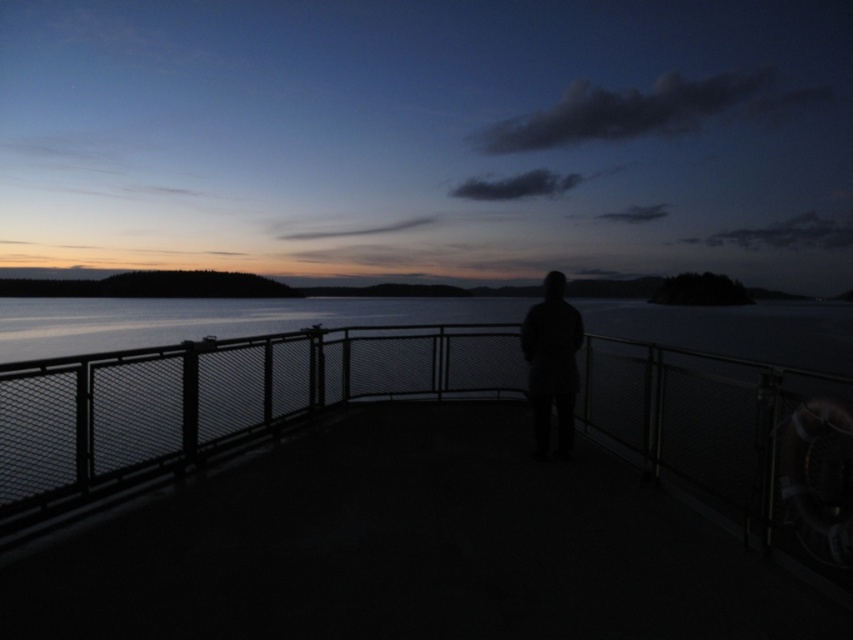
Question: Which point is farther from the camera taking this photo?

Choices:
 (A) (712, 394)
 (B) (804, 22)

Answer: (B)

Question: Is silhouette person at center smaller than metal mesh fence at center?

Choices:
 (A) no
 (B) yes

Answer: (A)

Question: Which of these objects is positioned farthest from the dark matte figure at center?

Choices:
 (A) metal mesh fence at center
 (B) silhouette person at center

Answer: (B)

Question: Which of the following is the closest to the observer?

Choices:
 (A) metal mesh fence at center
 (B) dark matte figure at center

Answer: (A)

Question: Is metal mesh fence at center thinner than dark matte figure at center?

Choices:
 (A) yes
 (B) no

Answer: (B)

Question: Does silhouette person at center appear on the left side of dark matte figure at center?

Choices:
 (A) yes
 (B) no

Answer: (A)